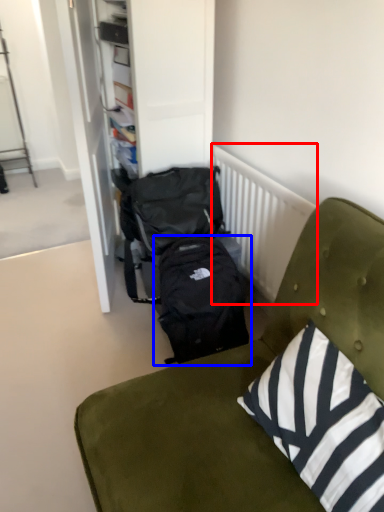
Question: Which object is closer to the camera taking this photo, radiator (highlighted by a red box) or backpack (highlighted by a blue box)?

Choices:
 (A) radiator
 (B) backpack

Answer: (A)